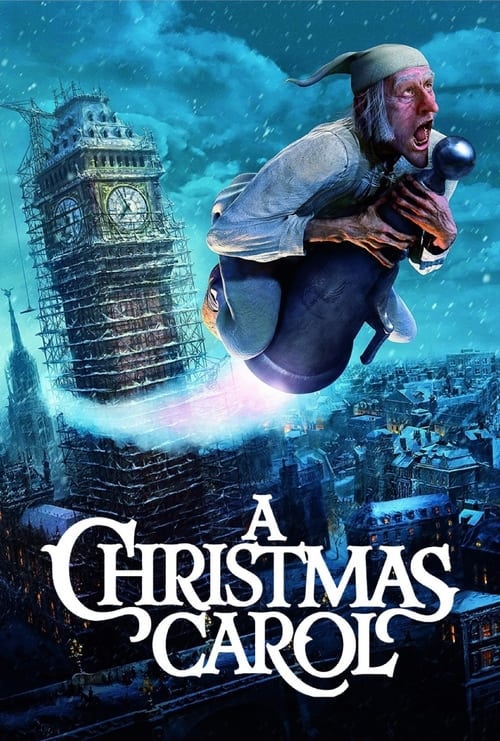
You are a GUI agent. You are given a task and a screenshot of the screen. Output one action in this format:
    pyautogui.click(x=<x>, y=<y>)
    Task: Click on the window
    
    Given the screenshot: What is the action you would take?
    pyautogui.click(x=487, y=631)